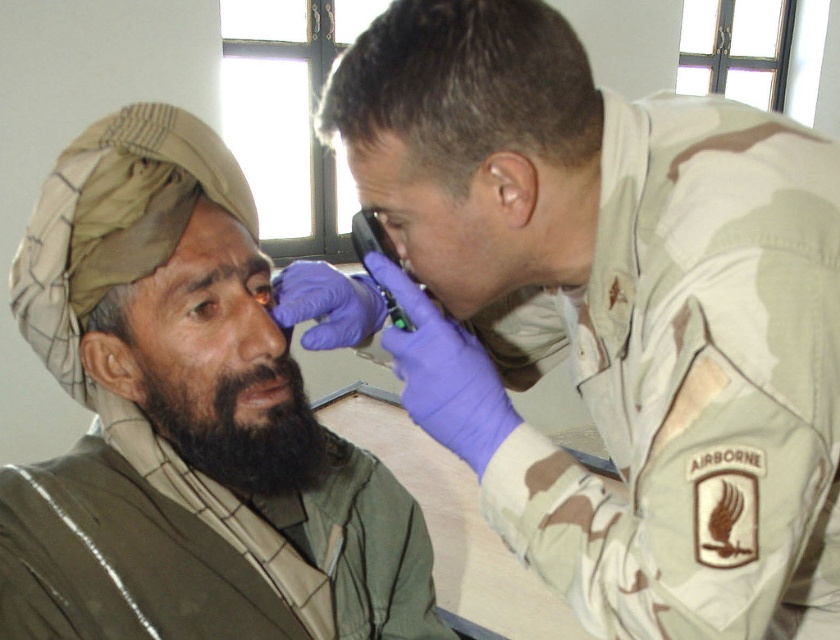
Between black fuzzy beard at lower left and brown matte forehead at upper left, which one appears on the left side from the viewer's perspective?

brown matte forehead at upper left is more to the left.

Measure the distance between point [255,426] and camera.

Point [255,426] and camera are 32.66 inches apart from each other.

Locate an element on the screen. The image size is (840, 640). black fuzzy beard at lower left is located at coordinates (239, 429).

Locate an element on the screen. Image resolution: width=840 pixels, height=640 pixels. bearded man at left is located at coordinates (184, 428).

Based on the photo, who is more forward, (232,483) or (203,208)?

Point (203,208) is in front.

Between point (450, 636) and point (223, 246), which one is positioned in front?

Positioned in front is point (223, 246).

This screenshot has height=640, width=840. I want to click on bearded man at left, so point(184,428).

From the picture: Is camo uniform at upper right positioned before short dark hair at upper center?

Yes, camo uniform at upper right is closer to the viewer.

Does camo uniform at upper right have a greater height compared to short dark hair at upper center?

Yes.

Is point (715, 339) closer to camera compared to point (350, 60)?

Yes, point (715, 339) is closer to viewer.

Identify the location of camo uniform at upper right. This screenshot has width=840, height=640. click(x=612, y=314).